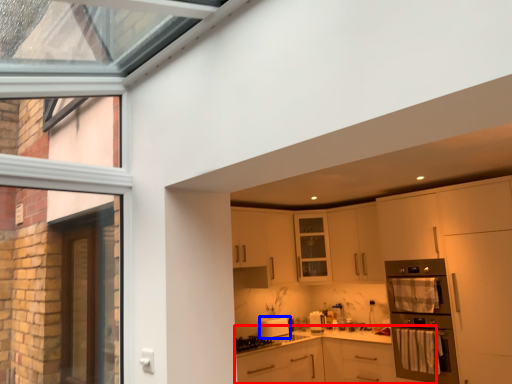
Question: Which object is closer to the camera taking this photo, cabinetry (highlighted by a red box) or kitchen appliance (highlighted by a blue box)?

Choices:
 (A) cabinetry
 (B) kitchen appliance

Answer: (A)